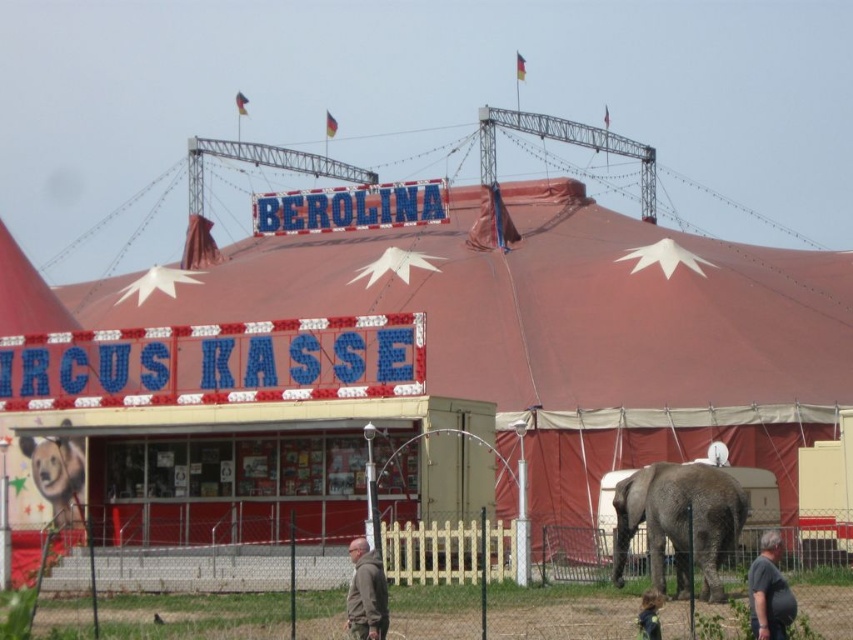
Question: Is red canvas tent at center in front of fat man at lower right?

Choices:
 (A) no
 (B) yes

Answer: (A)

Question: Considering the real-world distances, which object is closest to the fat man at lower right?

Choices:
 (A) gray hoodie at center
 (B) red canvas tent at center
 (C) brown plush bear at lower left
 (D) gray matte elephant at lower right

Answer: (D)

Question: Can you confirm if gray matte elephant at lower right is wider than gray hoodie at center?

Choices:
 (A) no
 (B) yes

Answer: (B)

Question: Which point is closer to the camera taking this photo?

Choices:
 (A) (688, 508)
 (B) (33, 438)

Answer: (A)

Question: Based on their relative distances, which object is nearer to the gray hoodie at center?

Choices:
 (A) red canvas tent at center
 (B) fat man at lower right

Answer: (B)

Question: Considering the relative positions of brown plush bear at lower left and fat man at lower right in the image provided, where is brown plush bear at lower left located with respect to fat man at lower right?

Choices:
 (A) above
 (B) below

Answer: (A)